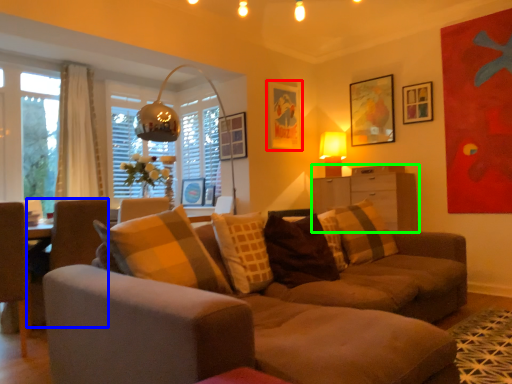
Question: Based on their relative distances, which object is nearer to picture frame (highlighted by a red box)? Choose from swivel chair (highlighted by a blue box) and dresser (highlighted by a green box).

Choices:
 (A) swivel chair
 (B) dresser

Answer: (B)